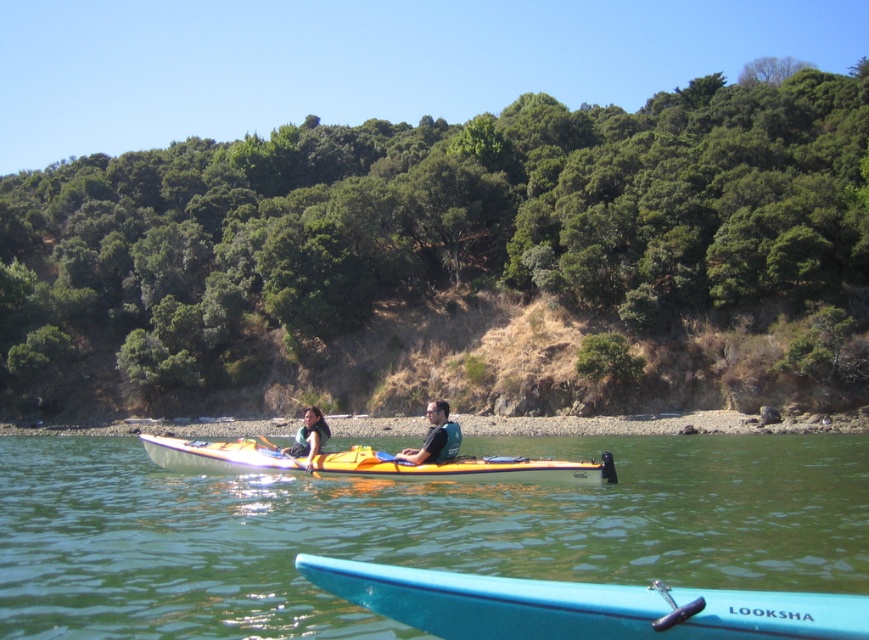
What do you see at coordinates (309, 436) in the screenshot? Image resolution: width=869 pixels, height=640 pixels. I see `matte green life vest at center` at bounding box center [309, 436].

This screenshot has width=869, height=640. Identify the location of matte green life vest at center. (309, 436).

Find the location of a particular element. This screenshot has width=869, height=640. matte green life vest at center is located at coordinates (309, 436).

Can you confirm if orange kayak at center is positioned below matte green life vest at center?

Yes.

Based on the photo, is orange kayak at center wider than matte green life vest at center?

In fact, orange kayak at center might be narrower than matte green life vest at center.

Which is in front, point (456, 426) or point (290, 445)?

Point (456, 426) is in front.

At what (x,y) coordinates should I click in order to perform the action: click on orange kayak at center. Please return your answer as a coordinate pair (x, y). This screenshot has height=640, width=869. Looking at the image, I should click on (433, 438).

Between blue plastic kayak at center and orange plastic kayak at center, which one is positioned lower?

blue plastic kayak at center is below.

Can you confirm if blue plastic kayak at center is positioned above orange plastic kayak at center?

No.

Who is more distant from viewer, [781,552] or [242,452]?

The point [242,452] is more distant.

Identify the location of blue plastic kayak at center. (408, 531).